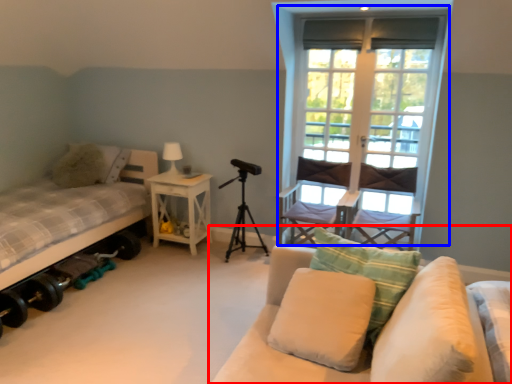
Question: Among these objects, which one is farthest to the camera, studio couch (highlighted by a red box) or window (highlighted by a blue box)?

Choices:
 (A) studio couch
 (B) window

Answer: (B)